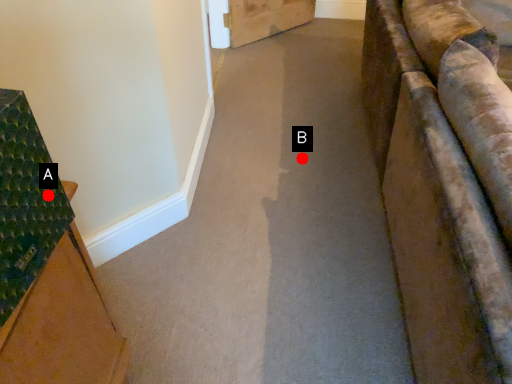
Question: Two points are circled on the image, labeled by A and B beside each circle. Among these points, which one is nearest to the camera?

Choices:
 (A) A is closer
 (B) B is closer

Answer: (A)